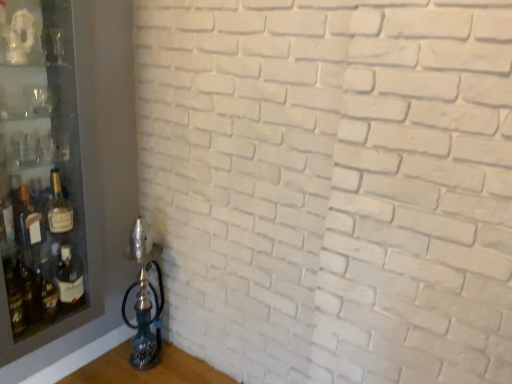
Measure the distance between transparent glass shelf at left and camera.

transparent glass shelf at left is 1.29 meters from camera.

Where is `transparent glass shelf at left`? The height and width of the screenshot is (384, 512). transparent glass shelf at left is located at coordinates (42, 179).

This screenshot has height=384, width=512. Describe the element at coordinates (42, 179) in the screenshot. I see `transparent glass shelf at left` at that location.

The height and width of the screenshot is (384, 512). Find the location of `matte glass bottle at left`. matte glass bottle at left is located at coordinates (59, 207).

The image size is (512, 384). Describe the element at coordinates (59, 207) in the screenshot. I see `matte glass bottle at left` at that location.

Find the location of a particular element. transparent glass shelf at left is located at coordinates (42, 179).

Considering the relative positions of matte glass bottle at left and transparent glass shelf at left in the image provided, is matte glass bottle at left to the right of transparent glass shelf at left from the viewer's perspective?

Yes.

From the picture: Between matte glass bottle at left and transparent glass shelf at left, which one is positioned behind?

matte glass bottle at left is further away from the camera.

Does point (72, 208) appear closer or farther from the camera than point (29, 3)?

Point (72, 208) appears to be farther away from the viewer than point (29, 3).

From the image's perspective, is matte glass bottle at left under transparent glass shelf at left?

Correct, matte glass bottle at left appears lower than transparent glass shelf at left in the image.

From a real-world perspective, is matte glass bottle at left positioned over transparent glass shelf at left based on gravity?

No, from a real-world perspective, matte glass bottle at left is not above transparent glass shelf at left.

From the picture: Between matte glass bottle at left and transparent glass shelf at left, which one has larger width?

transparent glass shelf at left.

Between matte glass bottle at left and transparent glass shelf at left, which one has more height?

With more height is transparent glass shelf at left.

Does matte glass bottle at left have a larger size compared to transparent glass shelf at left?

Incorrect, matte glass bottle at left is not larger than transparent glass shelf at left.

Is transparent glass shelf at left completely or partially inside matte glass bottle at left?

No.

Is matte glass bottle at left not near transparent glass shelf at left?

That's not correct — matte glass bottle at left is a little close to transparent glass shelf at left.

Is matte glass bottle at left facing towards transparent glass shelf at left?

Yes, matte glass bottle at left is aimed at transparent glass shelf at left.

How much distance is there between matte glass bottle at left and transparent glass shelf at left?

matte glass bottle at left and transparent glass shelf at left are 7.60 inches apart from each other.

Image resolution: width=512 pixels, height=384 pixels. What are the coordinates of `shelf on the left of matte glass bottle at left` in the screenshot? It's located at (42, 179).

Considering the positions of objects transparent glass shelf at left and matte glass bottle at left in the image provided, who is more to the left, transparent glass shelf at left or matte glass bottle at left?

Positioned to the left is transparent glass shelf at left.

Which object is closer to the camera taking this photo, transparent glass shelf at left or matte glass bottle at left?

transparent glass shelf at left.

Which is nearer, (0, 168) or (52, 210)?

Point (0, 168) is closer to the camera than point (52, 210).

Consider the image. From the image's perspective, which is below, transparent glass shelf at left or matte glass bottle at left?

From the image's view, matte glass bottle at left is below.

From a real-world perspective, which is physically above, transparent glass shelf at left or matte glass bottle at left?

In real-world perspective, transparent glass shelf at left is above.

Which of these two, transparent glass shelf at left or matte glass bottle at left, is wider?

transparent glass shelf at left is wider.

Considering the relative sizes of transparent glass shelf at left and matte glass bottle at left in the image provided, is transparent glass shelf at left shorter than matte glass bottle at left?

Incorrect, the height of transparent glass shelf at left does not fall short of that of matte glass bottle at left.

Looking at this image, is transparent glass shelf at left smaller than matte glass bottle at left?

No, transparent glass shelf at left is not smaller than matte glass bottle at left.

Would you say transparent glass shelf at left is inside or outside matte glass bottle at left?

transparent glass shelf at left exists outside the volume of matte glass bottle at left.

Would you say transparent glass shelf at left is a long distance from matte glass bottle at left?

Actually, transparent glass shelf at left and matte glass bottle at left are a little close together.

Is transparent glass shelf at left looking in the opposite direction of matte glass bottle at left?

Yes, matte glass bottle at left is at the back of transparent glass shelf at left.

How many degrees apart are the facing directions of transparent glass shelf at left and matte glass bottle at left?

0.00674 degrees.

How far apart are transparent glass shelf at left and matte glass bottle at left?

transparent glass shelf at left is 7.60 inches from matte glass bottle at left.

The height and width of the screenshot is (384, 512). Find the location of `bottle that appears behind the transparent glass shelf at left`. bottle that appears behind the transparent glass shelf at left is located at coordinates (59, 207).

The width and height of the screenshot is (512, 384). I want to click on shelf located in front of the matte glass bottle at left, so click(42, 179).

You are a GUI agent. You are given a task and a screenshot of the screen. Output one action in this format:
    pyautogui.click(x=<x>, y=<y>)
    Task: Click on the bottle to the right of transparent glass shelf at left
    This screenshot has height=384, width=512.
    Given the screenshot: What is the action you would take?
    pyautogui.click(x=59, y=207)